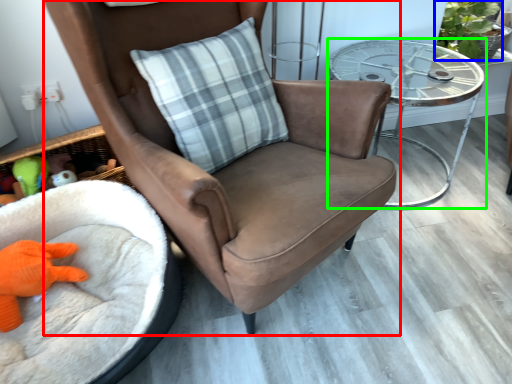
Question: Which object is the closest to the chair (highlighted by a red box)? Choose among these: plant (highlighted by a blue box) or table (highlighted by a green box).

Choices:
 (A) plant
 (B) table

Answer: (B)